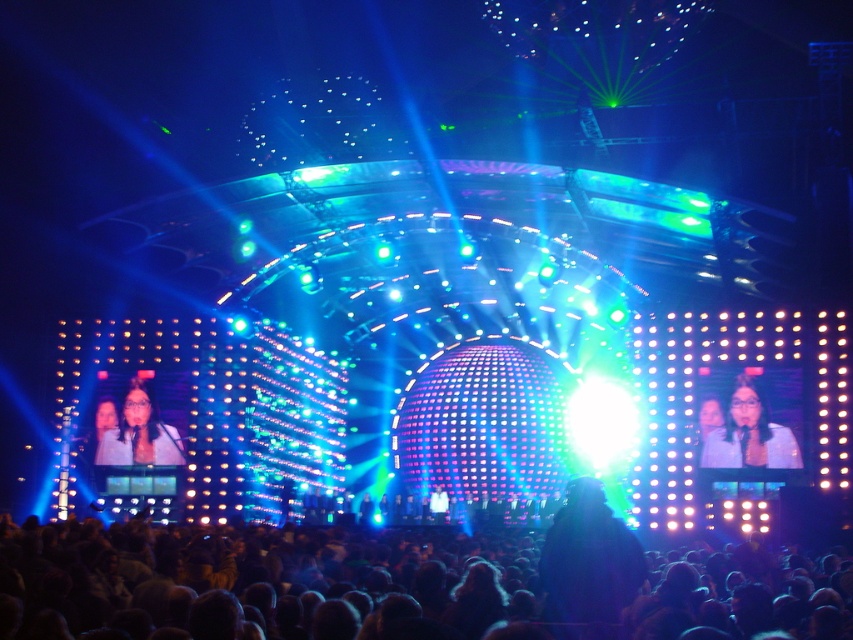
You are a photographer at the concert and want to capture a photo where both the matte white shirt at right and the matte white microphone at center are visible. Based on their positions, which object should be placed on the right side of the photo frame?

The matte white shirt at right should be placed on the right side of the photo frame since it is positioned to the right of the matte white microphone at center.